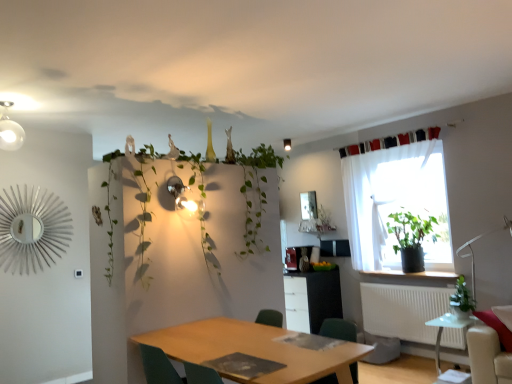
Question: From a real-world perspective, does green leafy plant at upper center sit lower than matte white light fixture at upper center?

Choices:
 (A) no
 (B) yes

Answer: (B)

Question: Considering the relative sizes of green leafy plant at upper center and matte white light fixture at upper center in the image provided, is green leafy plant at upper center taller than matte white light fixture at upper center?

Choices:
 (A) yes
 (B) no

Answer: (A)

Question: Considering the relative sizes of green leafy plant at upper center and matte white light fixture at upper center in the image provided, is green leafy plant at upper center smaller than matte white light fixture at upper center?

Choices:
 (A) no
 (B) yes

Answer: (A)

Question: Is green leafy plant at upper center in contact with matte white light fixture at upper center?

Choices:
 (A) yes
 (B) no

Answer: (B)

Question: Is green leafy plant at upper center shorter than matte white light fixture at upper center?

Choices:
 (A) yes
 (B) no

Answer: (B)

Question: From a real-world perspective, is green leafy plant at upper center on matte white light fixture at upper center?

Choices:
 (A) yes
 (B) no

Answer: (B)

Question: From the image's perspective, is white plastic radiator at lower right located beneath transparent glass table at lower right, which is the 1th table from right to left?

Choices:
 (A) yes
 (B) no

Answer: (B)

Question: Considering the relative sizes of white plastic radiator at lower right and transparent glass table at lower right, the 1th table from the back, in the image provided, is white plastic radiator at lower right smaller than transparent glass table at lower right, the 1th table from the back,?

Choices:
 (A) no
 (B) yes

Answer: (B)

Question: Considering the relative sizes of white plastic radiator at lower right and transparent glass table at lower right, the 2th table when ordered from front to back, in the image provided, is white plastic radiator at lower right thinner than transparent glass table at lower right, the 2th table when ordered from front to back,?

Choices:
 (A) yes
 (B) no

Answer: (A)

Question: Can you see white plastic radiator at lower right touching transparent glass table at lower right, which is the 1th table from right to left?

Choices:
 (A) no
 (B) yes

Answer: (A)

Question: Is white plastic radiator at lower right behind transparent glass table at lower right, acting as the 2th table starting from the left?

Choices:
 (A) yes
 (B) no

Answer: (A)

Question: From a real-world perspective, is white plastic radiator at lower right over transparent glass table at lower right, the 2th table when ordered from front to back?

Choices:
 (A) yes
 (B) no

Answer: (A)

Question: From a real-world perspective, is black fabric curtain at upper right below green leafy plant at right, arranged as the second houseplant when viewed from the back?

Choices:
 (A) no
 (B) yes

Answer: (A)